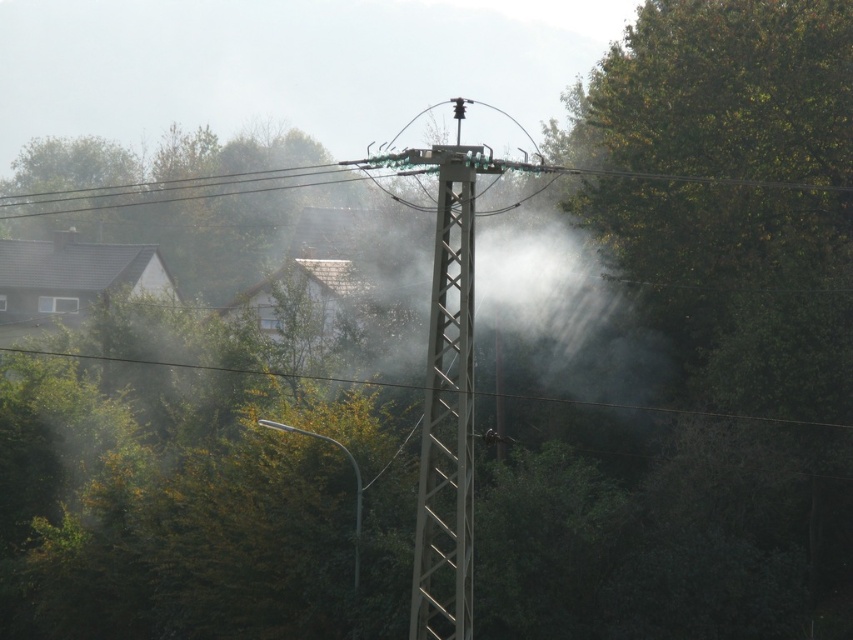
You are a maintenance worker needing to inspect the metallic gray telegraph pole at center and the green leafy tree at upper left. Based on the scene, which object is closer to you?

The metallic gray telegraph pole at center is closer to you because it is in front of the green leafy tree at upper left.

You are a maintenance worker assessing the scene. You see the metallic gray telegraph pole at center and the green leafy tree at upper left. Which object appears smaller in the image?

The metallic gray telegraph pole at center appears smaller than the green leafy tree at upper left in the image.

You are a technician inspecting the utility pole. You notice two points marked on your map at coordinates point (466, 620) and point (44, 176). Which point is nearer to you when standing at the base of the pole?

Point (466, 620) is closer to the viewer than point (44, 176), so the point at (466, 620) is nearer to you when standing at the base of the pole.